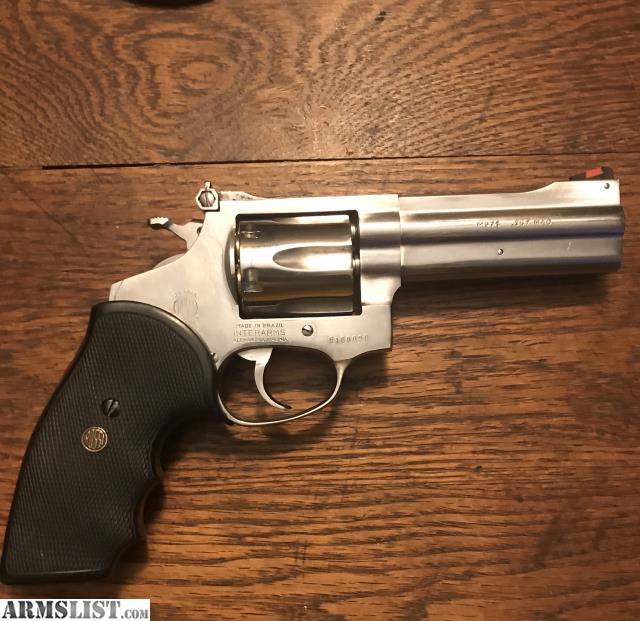
This screenshot has height=621, width=640. In order to click on handle in this screenshot , I will do [x=68, y=459].